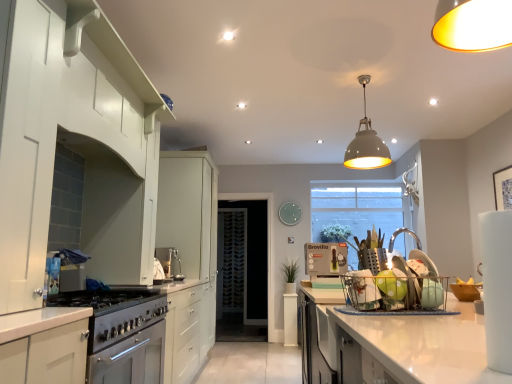
The height and width of the screenshot is (384, 512). Describe the element at coordinates (406, 281) in the screenshot. I see `polka dot ceramic dish rack at right, placed as the second appliance when sorted from right to left` at that location.

What is the approximate width of matte glass plate at center, which ranks as the fifth appliance in front-to-back order?

The width of matte glass plate at center, which ranks as the fifth appliance in front-to-back order, is 1.77 inches.

What do you see at coordinates (432, 293) in the screenshot? I see `clear glass bowl at right, marked as the first appliance in a front-to-back arrangement` at bounding box center [432, 293].

The width and height of the screenshot is (512, 384). I want to click on satin silver coffee machine at center, the 5th appliance when ordered from right to left, so click(170, 262).

Does point (144, 355) come closer to viewer compared to point (386, 273)?

No, it is behind (386, 273).

Are white glossy cabinet at lower left, which is the second cabinetry from back to front, and green matte apple at center far apart?

Yes, white glossy cabinet at lower left, which is the second cabinetry from back to front, is far from green matte apple at center.

Is white glossy cabinet at lower left, which is the 2th cabinetry in front-to-back order, positioned with its back to green matte apple at center?

No, white glossy cabinet at lower left, which is the 2th cabinetry in front-to-back order, is not facing away from green matte apple at center.

Which is behind, point (293, 203) or point (195, 328)?

The point (293, 203) is more distant.

From the image's perspective, is matte glass plate at center, the 3th appliance when ordered from left to right, over white glossy cabinet at left, acting as the third cabinetry starting from the front?

Correct, matte glass plate at center, the 3th appliance when ordered from left to right, appears higher than white glossy cabinet at left, acting as the third cabinetry starting from the front, in the image.

In terms of height, does matte glass plate at center, the 3th appliance when ordered from left to right, look taller or shorter compared to white glossy cabinet at left, acting as the third cabinetry starting from the front?

matte glass plate at center, the 3th appliance when ordered from left to right, is shorter than white glossy cabinet at left, acting as the third cabinetry starting from the front.

Does matte glass plate at center, acting as the 3th appliance starting from the right, have a lesser width compared to white glossy cabinet at left, acting as the third cabinetry starting from the front?

Yes.

Can we say satin silver coffee machine at center, the 1th appliance positioned from the left, lies outside satin silver gas stove at lower left?

satin silver coffee machine at center, the 1th appliance positioned from the left, lies outside satin silver gas stove at lower left's area.

Would you consider satin silver coffee machine at center, the 5th appliance when ordered from right to left, to be distant from satin silver gas stove at lower left?

Yes, satin silver coffee machine at center, the 5th appliance when ordered from right to left, and satin silver gas stove at lower left are located far from each other.

Which object is positioned more to the right, satin silver coffee machine at center, the 1th appliance positioned from the left, or satin silver gas stove at lower left?

satin silver coffee machine at center, the 1th appliance positioned from the left.

Is satin silver coffee machine at center, the 1th appliance positioned from the left, turned away from satin silver gas stove at lower left?

No, satin silver coffee machine at center, the 1th appliance positioned from the left, is not facing the opposite direction of satin silver gas stove at lower left.

Considering the positions of objects clear glass bowl at right, marked as the first appliance in a front-to-back arrangement, and satin silver gas stove at lower left in the image provided, who is more to the right, clear glass bowl at right, marked as the first appliance in a front-to-back arrangement, or satin silver gas stove at lower left?

clear glass bowl at right, marked as the first appliance in a front-to-back arrangement.

From a real-world perspective, is clear glass bowl at right, marked as the first appliance in a front-to-back arrangement, physically located above or below satin silver gas stove at lower left?

clear glass bowl at right, marked as the first appliance in a front-to-back arrangement, is situated higher than satin silver gas stove at lower left in the real world.

Is clear glass bowl at right, positioned as the fifth appliance in left-to-right order, wider or thinner than satin silver gas stove at lower left?

In the image, clear glass bowl at right, positioned as the fifth appliance in left-to-right order, appears to be more narrow than satin silver gas stove at lower left.

Is matte glass plate at center, which is the 1th appliance from back to front, bigger or smaller than satin silver coffee machine at center, the 1th appliance positioned from the left?

Considering their sizes, matte glass plate at center, which is the 1th appliance from back to front, takes up less space than satin silver coffee machine at center, the 1th appliance positioned from the left.

This screenshot has height=384, width=512. I want to click on the 2nd appliance to the right when counting from the satin silver coffee machine at center, the 2th appliance viewed from the back, so click(x=289, y=213).

From the image's perspective, which one is positioned higher, matte glass plate at center, which is the 1th appliance from back to front, or satin silver coffee machine at center, which appears as the 4th appliance when viewed from the front?

matte glass plate at center, which is the 1th appliance from back to front.

Considering their positions, is clear glass bowl at right, marked as the first appliance in a front-to-back arrangement, located in front of or behind green matte plant at center?

In the image, clear glass bowl at right, marked as the first appliance in a front-to-back arrangement, appears in front of green matte plant at center.

Is green matte plant at center surrounded by clear glass bowl at right, the 5th appliance positioned from the back?

That's incorrect, green matte plant at center is not inside clear glass bowl at right, the 5th appliance positioned from the back.

From a real-world perspective, is clear glass bowl at right, marked as the first appliance in a front-to-back arrangement, above or below green matte plant at center?

clear glass bowl at right, marked as the first appliance in a front-to-back arrangement, is situated higher than green matte plant at center in the real world.

Considering the relative positions of clear glass bowl at right, marked as the first appliance in a front-to-back arrangement, and green matte plant at center in the image provided, is clear glass bowl at right, marked as the first appliance in a front-to-back arrangement, to the right of green matte plant at center from the viewer's perspective?

Yes, clear glass bowl at right, marked as the first appliance in a front-to-back arrangement, is to the right of green matte plant at center.

Is white glossy cabinet at left, acting as the third cabinetry starting from the front, next to green matte apple at center and touching it?

They are not placed beside each other.

Who is shorter, white glossy cabinet at left, which ranks as the first cabinetry in back-to-front order, or green matte apple at center?

green matte apple at center is shorter.

Could you tell me if white glossy cabinet at left, which ranks as the first cabinetry in back-to-front order, is facing green matte apple at center?

No, white glossy cabinet at left, which ranks as the first cabinetry in back-to-front order, is not facing towards green matte apple at center.

In order to click on the 2nd cabinetry to the left of the green matte apple at center, starting your count from the anchor in this screenshot , I will do `click(112, 338)`.

Image resolution: width=512 pixels, height=384 pixels. Identify the location of the 5th appliance positioned above the white glossy cabinet at left, acting as the third cabinetry starting from the front (from the image's perspective). (289, 213).

Which object lies further to the anchor point green plastic kettle at center, satin silver coffee machine at center, the 1th appliance positioned from the left, or green matte apple at center?

green matte apple at center lies further to green plastic kettle at center than the other object.

Estimate the real-world distances between objects in this image. Which object is closer to transparent glass door at center, green plastic kettle at center or polka dot ceramic dish rack at right, the fourth appliance when ordered from left to right?

Among the two, green plastic kettle at center is located nearer to transparent glass door at center.

Based on their spatial positions, is green plastic kettle at center or green matte plant at center closer to white glossy cabinet at left, acting as the third cabinetry starting from the front?

green plastic kettle at center.

Looking at the image, which one is located closer to green matte apple at center, white matte pendant light at upper center or green matte plant at center?

white matte pendant light at upper center.

Looking at the image, which one is located closer to white glossy cabinet at left, which ranks as the first cabinetry in back-to-front order, green plastic kettle at center or matte glass plate at center, which is the 1th appliance from back to front?

green plastic kettle at center lies closer to white glossy cabinet at left, which ranks as the first cabinetry in back-to-front order, than the other object.

Considering their positions, is satin silver gas stove at lower left positioned closer to transparent glass door at center than green matte plant at center?

Among the two, green matte plant at center is located nearer to transparent glass door at center.

Looking at this image, looking at the image, which one is located further to clear glass bowl at right, the 5th appliance positioned from the back, green matte plant at center or white matte pendant light at upper center?

green matte plant at center lies further to clear glass bowl at right, the 5th appliance positioned from the back, than the other object.

Looking at the image, which one is located closer to green matte apple at center, satin white cabinet at lower left, which is counted as the third cabinetry, starting from the back, or matte glass plate at center, which is the 1th appliance from back to front?

satin white cabinet at lower left, which is counted as the third cabinetry, starting from the back, is positioned closer to the anchor green matte apple at center.

This screenshot has height=384, width=512. In order to click on picture frame between polka dot ceramic dish rack at right, placed as the second appliance when sorted from right to left, and green matte plant at center, along the z-axis in this screenshot , I will do `click(503, 188)`.

The image size is (512, 384). Identify the location of kitchen appliance between clear glass bowl at right, the 5th appliance positioned from the back, and satin silver coffee machine at center, which appears as the 4th appliance when viewed from the front, from front to back. (326, 259).

Find the location of a particular element. The height and width of the screenshot is (384, 512). gas stove located between clear glass bowl at right, marked as the first appliance in a front-to-back arrangement, and white glossy cabinet at left, acting as the third cabinetry starting from the front, in the depth direction is located at coordinates (115, 312).

I want to click on kitchen appliance between white glossy cabinet at lower left, which is the 2th cabinetry in front-to-back order, and transparent glass door at center, along the z-axis, so click(x=326, y=259).